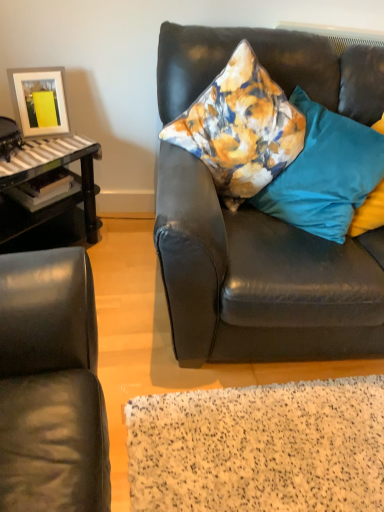
Describe the element at coordinates (369, 212) in the screenshot. I see `teal fabric pillow at right, the 3th pillow in the left-to-right sequence` at that location.

Locate an element on the screen. This screenshot has height=512, width=384. matte black couch at center is located at coordinates (259, 278).

Where is `floral fabric pillow at upper right, the third pillow viewed from the right`? floral fabric pillow at upper right, the third pillow viewed from the right is located at coordinates (240, 128).

How much space does floral fabric pillow at upper right, acting as the first pillow starting from the left, occupy vertically?

49.57 centimeters.

Image resolution: width=384 pixels, height=512 pixels. What are the coordinates of `matte white picture frame at upper left` in the screenshot? It's located at (39, 100).

Image resolution: width=384 pixels, height=512 pixels. Identify the location of teal fabric pillow at right, which is the 1th pillow in right-to-left order. (369, 212).

Can you confirm if matte black couch at center is thinner than teal fabric pillow at right, the 3th pillow in the left-to-right sequence?

Incorrect, the width of matte black couch at center is not less than that of teal fabric pillow at right, the 3th pillow in the left-to-right sequence.

Starting from the matte black couch at center, which pillow is the 3rd one behind? Please provide its 2D coordinates.

[(369, 212)]

Which is behind, matte black couch at center or teal fabric pillow at right, which is the 1th pillow in right-to-left order?

Positioned behind is teal fabric pillow at right, which is the 1th pillow in right-to-left order.

Is velvet floral pillow at center, which appears as the 2th pillow when viewed from the left, shorter than floral fabric pillow at upper right, acting as the first pillow starting from the left?

No.

I want to click on the 1st pillow to the right of the floral fabric pillow at upper right, acting as the first pillow starting from the left, starting your count from the anchor, so click(x=325, y=173).

From a real-world perspective, is velvet floral pillow at center, which appears as the 2th pillow when viewed from the left, beneath floral fabric pillow at upper right, the third pillow viewed from the right?

Yes, from a real-world perspective, velvet floral pillow at center, which appears as the 2th pillow when viewed from the left, is beneath floral fabric pillow at upper right, the third pillow viewed from the right.

Which object is closer to the camera, teal fabric pillow at right, the 3th pillow in the left-to-right sequence, or matte black couch at center?

matte black couch at center is more forward.

From a real-world perspective, is teal fabric pillow at right, which is the 1th pillow in right-to-left order, beneath matte black couch at center?

No, from a real-world perspective, teal fabric pillow at right, which is the 1th pillow in right-to-left order, is not below matte black couch at center.

From the image's perspective, relative to matte black couch at center, is teal fabric pillow at right, which is the 1th pillow in right-to-left order, above or below?

teal fabric pillow at right, which is the 1th pillow in right-to-left order, is above matte black couch at center.

Between point (373, 203) and point (309, 255), which one is positioned in front?

The point (309, 255) is closer.

Considering the positions of objects matte white picture frame at upper left and velvet floral pillow at center, which appears as the 2th pillow when viewed from the left, in the image provided, who is more to the left, matte white picture frame at upper left or velvet floral pillow at center, which appears as the 2th pillow when viewed from the left,?

Positioned to the left is matte white picture frame at upper left.

Based on the photo, would you say matte white picture frame at upper left is outside velvet floral pillow at center, which is the second pillow from right to left?

matte white picture frame at upper left lies outside velvet floral pillow at center, which is the second pillow from right to left,'s area.

Which object is closer to the camera, matte white picture frame at upper left or floral fabric pillow at upper right, the third pillow viewed from the right?

floral fabric pillow at upper right, the third pillow viewed from the right.

From a real-world perspective, who is located lower, matte white picture frame at upper left or floral fabric pillow at upper right, acting as the first pillow starting from the left?

matte white picture frame at upper left, from a real-world perspective.

Does matte white picture frame at upper left have a lesser width compared to floral fabric pillow at upper right, acting as the first pillow starting from the left?

Yes.

Which object is positioned more to the right, matte white picture frame at upper left or floral fabric pillow at upper right, the third pillow viewed from the right?

floral fabric pillow at upper right, the third pillow viewed from the right, is more to the right.

From the image's perspective, which one is positioned lower, matte black couch at center or velvet floral pillow at center, which appears as the 2th pillow when viewed from the left?

matte black couch at center appears lower in the image.

Looking at their sizes, would you say matte black couch at center is wider or thinner than velvet floral pillow at center, which is the second pillow from right to left?

Considering their sizes, matte black couch at center looks broader than velvet floral pillow at center, which is the second pillow from right to left.

Which object is further away from the camera, matte black couch at center or velvet floral pillow at center, which appears as the 2th pillow when viewed from the left?

velvet floral pillow at center, which appears as the 2th pillow when viewed from the left, is further from the camera.

Who is smaller, matte black couch at center or velvet floral pillow at center, which is the second pillow from right to left?

velvet floral pillow at center, which is the second pillow from right to left.

Is matte black couch at center smaller than matte white picture frame at upper left?

No, matte black couch at center is not smaller than matte white picture frame at upper left.

From a real-world perspective, who is located lower, matte black couch at center or matte white picture frame at upper left?

In real-world perspective, matte black couch at center is lower.

Looking at this image, what's the angular difference between matte black couch at center and matte white picture frame at upper left's facing directions?

The facing directions of matte black couch at center and matte white picture frame at upper left are 17 degrees apart.

You are a GUI agent. You are given a task and a screenshot of the screen. Output one action in this format:
    pyautogui.click(x=<x>, y=<y>)
    Task: Click on the studio couch below the teal fabric pillow at right, which is the 1th pillow in right-to-left order (from a real-world perspective)
    
    Given the screenshot: What is the action you would take?
    pyautogui.click(x=259, y=278)

Where is `pillow positioned vertically above the velvet floral pillow at center, which appears as the 2th pillow when viewed from the left (from a real-world perspective)`? pillow positioned vertically above the velvet floral pillow at center, which appears as the 2th pillow when viewed from the left (from a real-world perspective) is located at coordinates (240, 128).

Considering their positions, is velvet floral pillow at center, which is the second pillow from right to left, positioned further to teal fabric pillow at right, which is the 1th pillow in right-to-left order, than matte white picture frame at upper left?

matte white picture frame at upper left is positioned further to the anchor teal fabric pillow at right, which is the 1th pillow in right-to-left order.

Looking at the image, which one is located closer to velvet floral pillow at center, which is the second pillow from right to left, floral fabric pillow at upper right, the third pillow viewed from the right, or teal fabric pillow at right, the 3th pillow in the left-to-right sequence?

teal fabric pillow at right, the 3th pillow in the left-to-right sequence, lies closer to velvet floral pillow at center, which is the second pillow from right to left, than the other object.

Which object lies nearer to the anchor point floral fabric pillow at upper right, acting as the first pillow starting from the left, velvet floral pillow at center, which is the second pillow from right to left, or matte black couch at center?

The object closer to floral fabric pillow at upper right, acting as the first pillow starting from the left, is velvet floral pillow at center, which is the second pillow from right to left.

Looking at the image, which one is located further to matte white picture frame at upper left, velvet floral pillow at center, which appears as the 2th pillow when viewed from the left, or matte black couch at center?

velvet floral pillow at center, which appears as the 2th pillow when viewed from the left, lies further to matte white picture frame at upper left than the other object.

Based on their spatial positions, is floral fabric pillow at upper right, acting as the first pillow starting from the left, or velvet floral pillow at center, which appears as the 2th pillow when viewed from the left, further from teal fabric pillow at right, which is the 1th pillow in right-to-left order?

floral fabric pillow at upper right, acting as the first pillow starting from the left, is positioned further to the anchor teal fabric pillow at right, which is the 1th pillow in right-to-left order.

Which object lies further to the anchor point matte white picture frame at upper left, floral fabric pillow at upper right, the third pillow viewed from the right, or velvet floral pillow at center, which is the second pillow from right to left?

Among the two, velvet floral pillow at center, which is the second pillow from right to left, is located further to matte white picture frame at upper left.

Based on their spatial positions, is matte black couch at center or matte white picture frame at upper left further from velvet floral pillow at center, which is the second pillow from right to left?

matte white picture frame at upper left is further to velvet floral pillow at center, which is the second pillow from right to left.

Estimate the real-world distances between objects in this image. Which object is further from velvet floral pillow at center, which appears as the 2th pillow when viewed from the left, teal fabric pillow at right, the 3th pillow in the left-to-right sequence, or matte white picture frame at upper left?

matte white picture frame at upper left.

The height and width of the screenshot is (512, 384). Identify the location of studio couch between matte white picture frame at upper left and teal fabric pillow at right, which is the 1th pillow in right-to-left order. (259, 278).

The image size is (384, 512). I want to click on pillow between matte white picture frame at upper left and velvet floral pillow at center, which appears as the 2th pillow when viewed from the left, in the horizontal direction, so click(x=240, y=128).

At what (x,y) coordinates should I click in order to perform the action: click on pillow between matte black couch at center and velvet floral pillow at center, which appears as the 2th pillow when viewed from the left, along the z-axis. Please return your answer as a coordinate pair (x, y). Looking at the image, I should click on (240, 128).

You are a GUI agent. You are given a task and a screenshot of the screen. Output one action in this format:
    pyautogui.click(x=<x>, y=<y>)
    Task: Click on the studio couch located between floral fabric pillow at upper right, acting as the first pillow starting from the left, and teal fabric pillow at right, which is the 1th pillow in right-to-left order, in the left-right direction
    This screenshot has height=512, width=384.
    Given the screenshot: What is the action you would take?
    pyautogui.click(x=259, y=278)